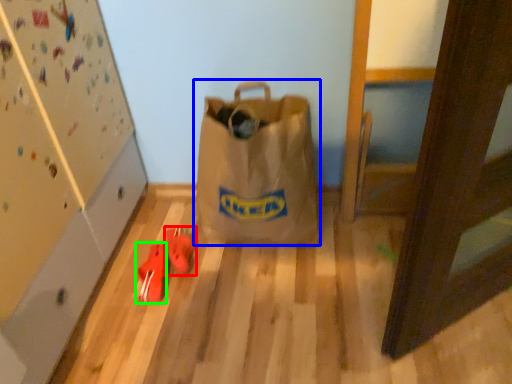
Question: Which object is the farthest from footwear (highlighted by a red box)? Choose among these: luggage and bags (highlighted by a blue box) or footwear (highlighted by a green box).

Choices:
 (A) luggage and bags
 (B) footwear

Answer: (A)